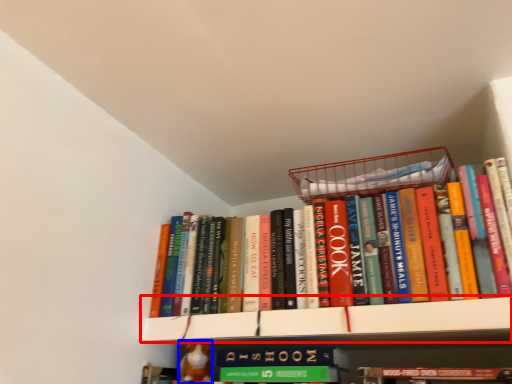
Question: Among these objects, which one is farthest to the camera, shelf (highlighted by a red box) or toy (highlighted by a blue box)?

Choices:
 (A) shelf
 (B) toy

Answer: (B)